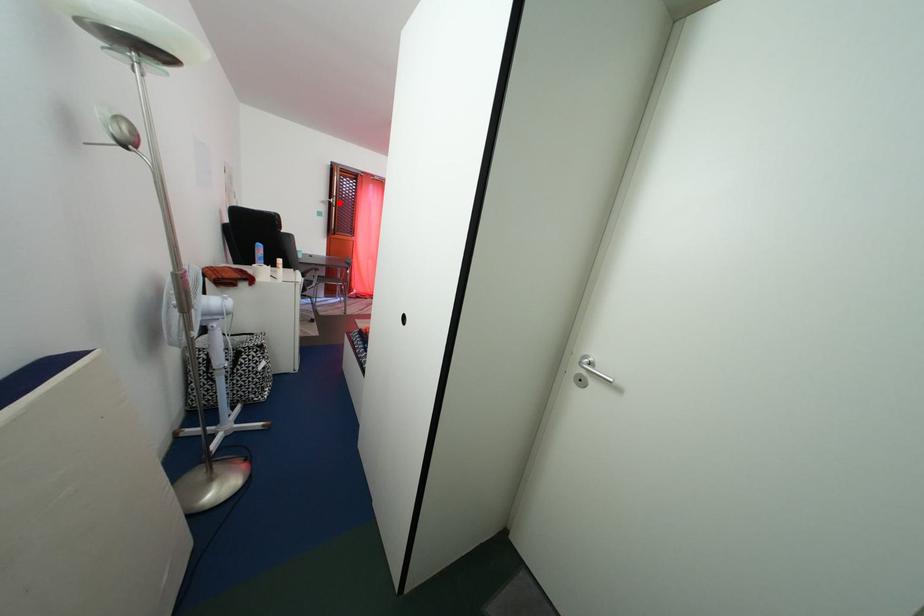
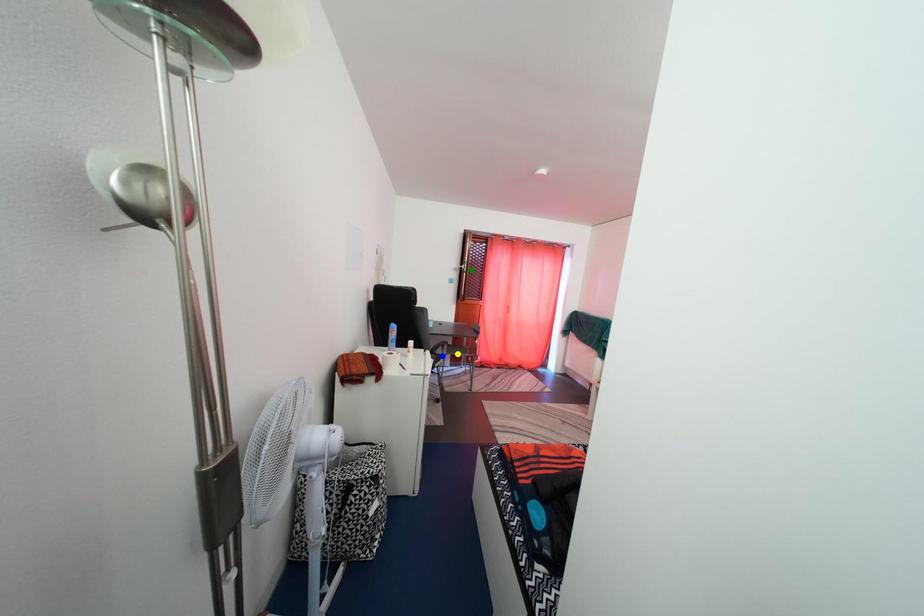
Question: I am providing you with two images of the same scene from different viewpoints. A red point is marked on the first image. You are given multiple points on the second image. Which spot in image 2 lines up with the point in image 1?

Choices:
 (A) blue point
 (B) green point
 (C) yellow point

Answer: (B)